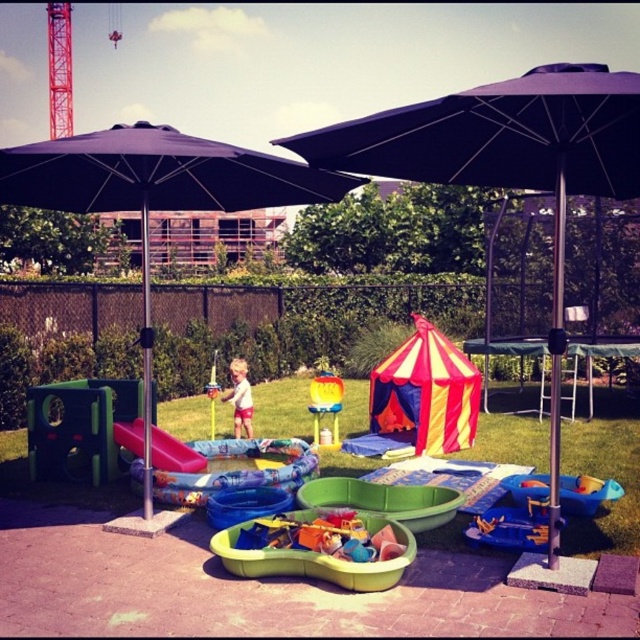
You are a parent supervising children at the play area. You notice a child wearing light blue shorts at center and another child holding a metallic silver toy at center. Which child is standing closer to the inflatable pool with a slide?

The light blue shorts at center is taller than metallic silver toy at center, so the child wearing light blue shorts at center is likely standing closer to the inflatable pool with a slide since taller objects are often positioned closer to the slide for better visibility and accessibility.